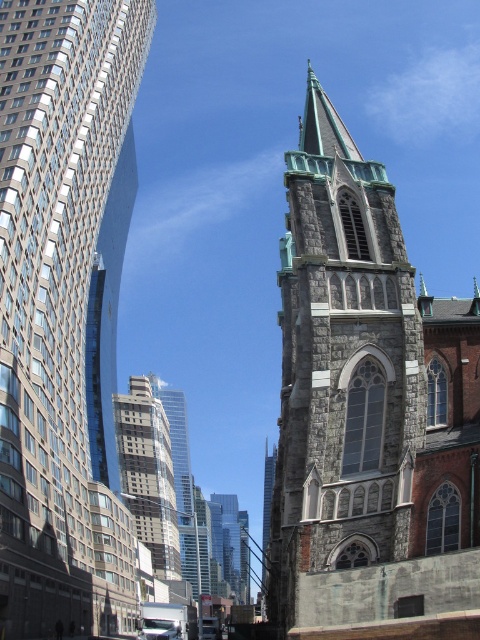
Question: Does gray stone church steeple at center have a greater width compared to gray stone church steeple at right?

Choices:
 (A) yes
 (B) no

Answer: (A)

Question: Is gray stone church steeple at center positioned at the back of gray stone church steeple at right?

Choices:
 (A) no
 (B) yes

Answer: (A)

Question: Which point is closer to the camera?

Choices:
 (A) gray stone church steeple at right
 (B) gray stone church steeple at center

Answer: (B)

Question: Can you confirm if gray stone church steeple at center is positioned below gray stone church steeple at right?

Choices:
 (A) no
 (B) yes

Answer: (B)